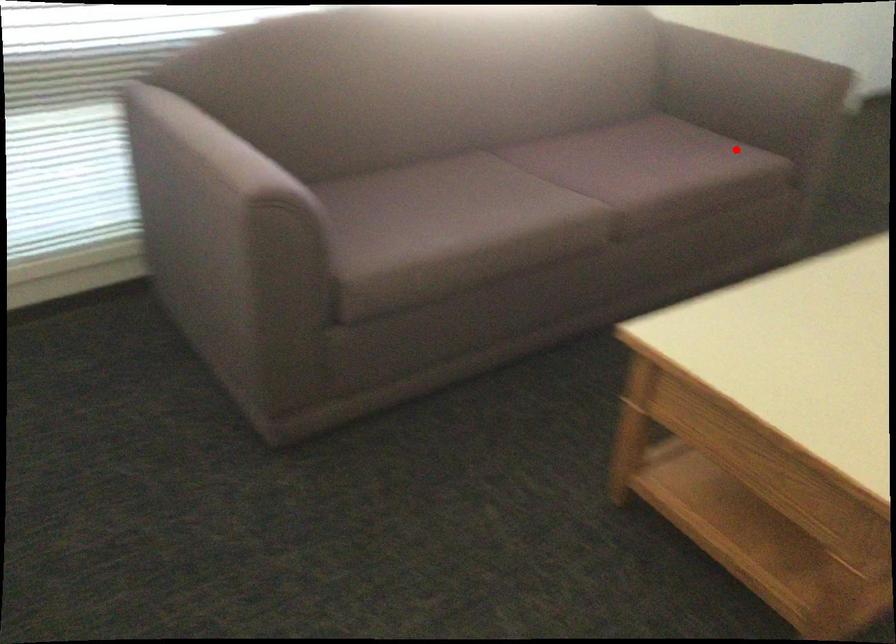
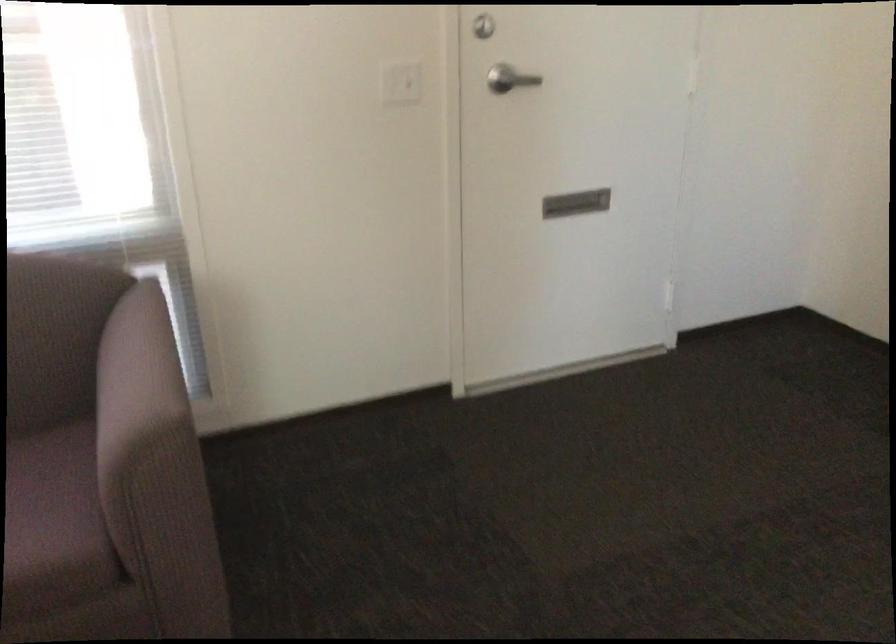
The point at the highlighted location is marked in the first image. Where is the corresponding point in the second image?

(53, 520)